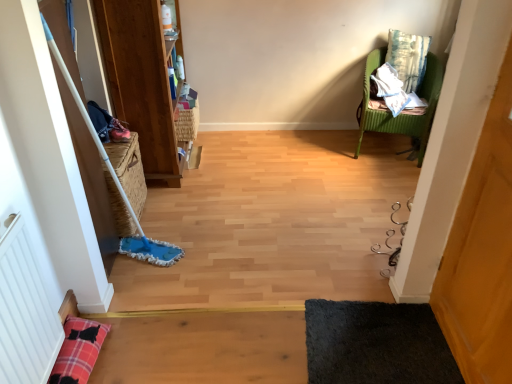
The height and width of the screenshot is (384, 512). I want to click on vacant area that lies in front of green ribbed chair at upper right, so click(378, 177).